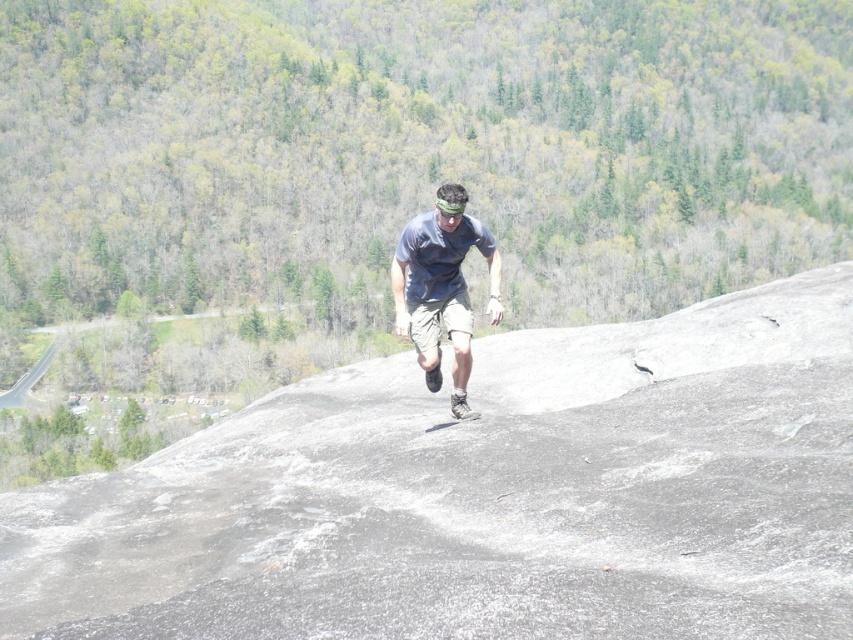
Does gray rock at center lie in front of matte blue shirt at center?

Yes.

Is gray rock at center shorter than matte blue shirt at center?

Correct, gray rock at center is not as tall as matte blue shirt at center.

Which is behind, point (741, 566) or point (486, 262)?

The point (486, 262) is more distant.

The image size is (853, 640). I want to click on gray rock at center, so click(486, 493).